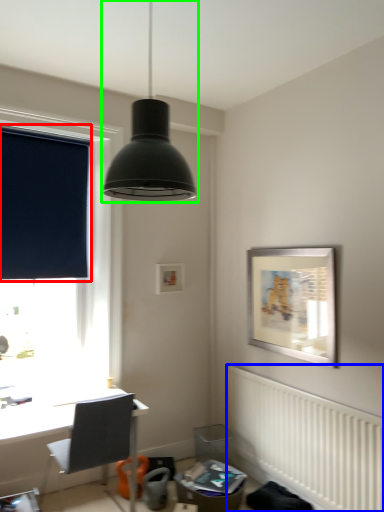
Question: Considering the real-world distances, which object is closest to window screen (highlighted by a red box)? radiator (highlighted by a blue box) or lamp (highlighted by a green box).

Choices:
 (A) radiator
 (B) lamp

Answer: (A)